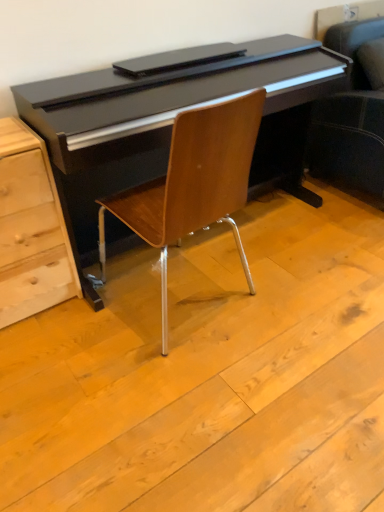
The width and height of the screenshot is (384, 512). Find the location of `free spot to the right of woodenchair at center`. free spot to the right of woodenchair at center is located at coordinates (294, 290).